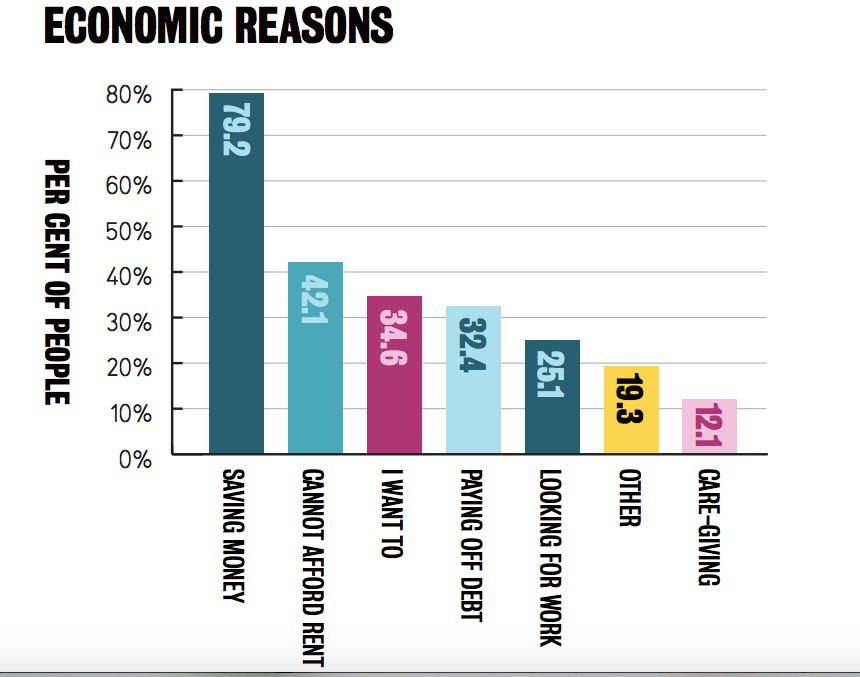
At what (x,y) coordinates should I click in order to perform the action: click on bar. Please return your answer as a coordinate pair (x, y). This screenshot has width=860, height=677. Looking at the image, I should click on (635, 437).